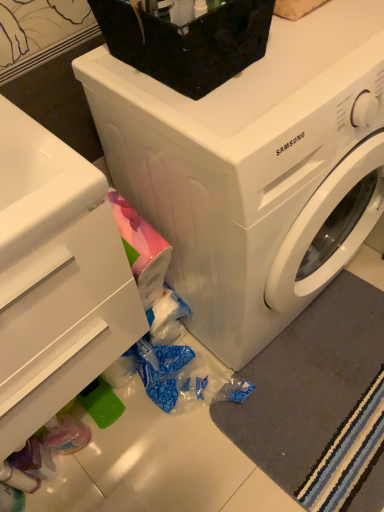
Locate an element on the screen. Image resolution: width=384 pixels, height=512 pixels. free spot in front of black plastic container at upper center is located at coordinates (235, 114).